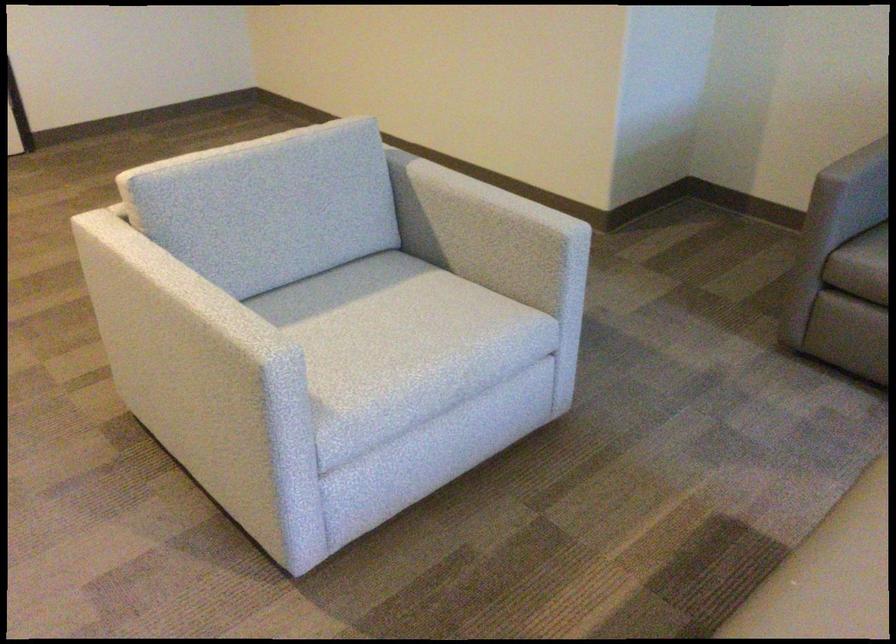
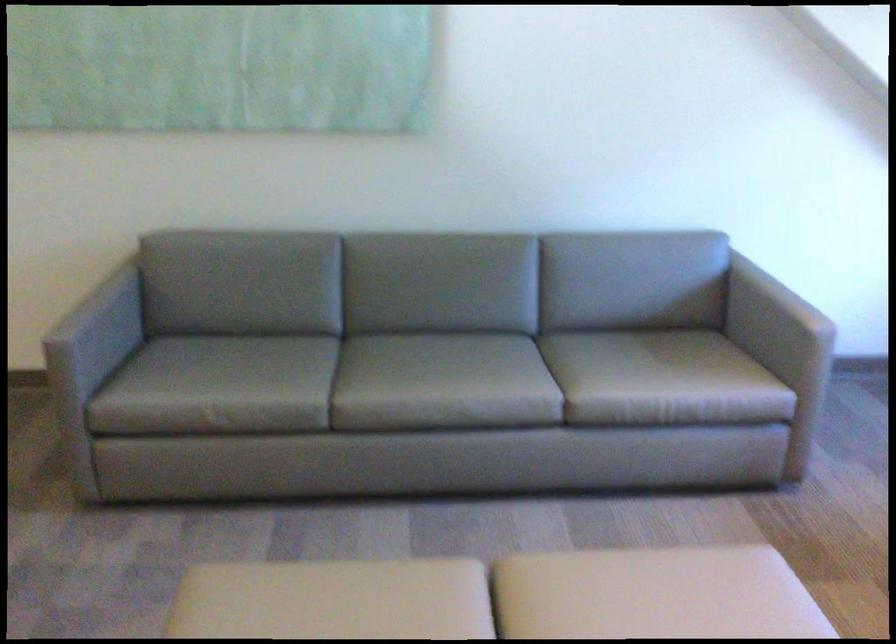
Question: The first image is from the beginning of the video and the second image is from the end. How did the camera likely rotate when shooting the video?

Choices:
 (A) Left
 (B) Right
 (C) Up
 (D) Down

Answer: (B)